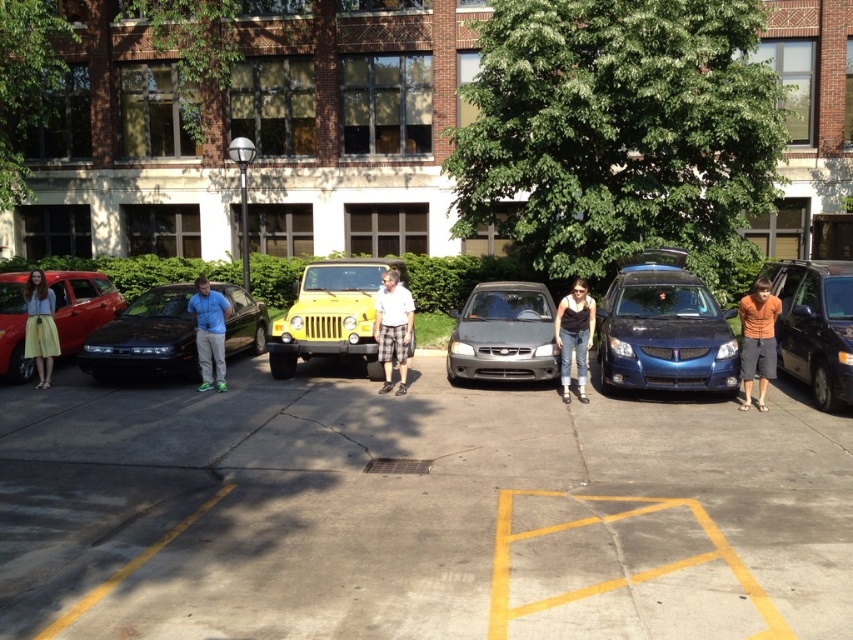
Question: Does yellow matte car at center appear under denim jeans at center?

Choices:
 (A) yes
 (B) no

Answer: (A)

Question: Which is farther from the glossy black sedan at center?

Choices:
 (A) denim jeans at center
 (B) metallic blue station wagon at center
 (C) matte red car at left
 (D) blue cotton shirt at center

Answer: (B)

Question: Is yellow matte car at center closer to the viewer compared to yellow skirt at left?

Choices:
 (A) yes
 (B) no

Answer: (A)

Question: Is metallic blue station wagon at center closer to the viewer compared to glossy black sedan at center?

Choices:
 (A) yes
 (B) no

Answer: (A)

Question: Based on their relative distances, which object is farther from the blue cotton shirt at center?

Choices:
 (A) satin silver minivan at center
 (B) metallic blue station wagon at center
 (C) white shirt at center
 (D) denim jeans at center

Answer: (B)

Question: Among these points, which one is nearest to the camera?

Choices:
 (A) (836, 353)
 (B) (15, 364)

Answer: (A)